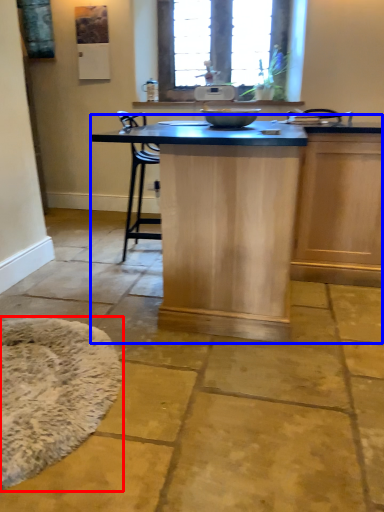
Question: Which point is further to the camera, mat (highlighted by a red box) or table (highlighted by a blue box)?

Choices:
 (A) mat
 (B) table

Answer: (B)